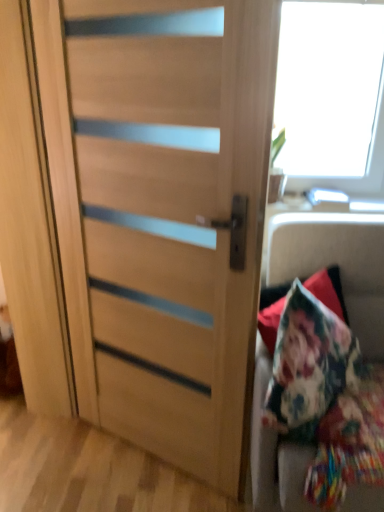
The image size is (384, 512). What do you see at coordinates (161, 213) in the screenshot?
I see `wooden door at center` at bounding box center [161, 213].

Locate an element on the screen. wooden door at center is located at coordinates (161, 213).

Where is `floral fabric cushion at right`? The image size is (384, 512). floral fabric cushion at right is located at coordinates (336, 263).

Describe the element at coordinates (336, 263) in the screenshot. This screenshot has width=384, height=512. I see `floral fabric cushion at right` at that location.

At what (x,y) coordinates should I click in order to perform the action: click on wooden door at center. Please return your answer as a coordinate pair (x, y). Looking at the image, I should click on (161, 213).

Which is more to the left, floral fabric cushion at right or wooden door at center?

From the viewer's perspective, wooden door at center appears more on the left side.

Based on the photo, considering the positions of objects floral fabric cushion at right and wooden door at center in the image provided, who is in front, floral fabric cushion at right or wooden door at center?

wooden door at center is closer to the camera.

Is point (290, 511) positioned behind point (207, 101)?

Yes, it is.

Looking at this image, from the image's perspective, is floral fabric cushion at right located above wooden door at center?

No, from the image's perspective, floral fabric cushion at right is not on top of wooden door at center.

From a real-world perspective, is floral fabric cushion at right physically above wooden door at center?

No, from a real-world perspective, floral fabric cushion at right is not over wooden door at center

Does floral fabric cushion at right have a lesser width compared to wooden door at center?

In fact, floral fabric cushion at right might be wider than wooden door at center.

Based on the photo, in terms of height, does floral fabric cushion at right look taller or shorter compared to wooden door at center?

Clearly, floral fabric cushion at right is shorter compared to wooden door at center.

Is floral fabric cushion at right smaller than wooden door at center?

No, floral fabric cushion at right is not smaller than wooden door at center.

Is floral fabric cushion at right surrounding wooden door at center?

No, wooden door at center is not a part of floral fabric cushion at right.

Is floral fabric cushion at right positioned far away from wooden door at center?

No, floral fabric cushion at right is in close proximity to wooden door at center.

Could you tell me if floral fabric cushion at right is facing wooden door at center?

No, floral fabric cushion at right is not aimed at wooden door at center.

The image size is (384, 512). In order to click on furniture that appears on the right of wooden door at center in this screenshot , I will do `click(336, 263)`.

Does wooden door at center appear on the left side of floral fabric cushion at right?

Yes, wooden door at center is to the left of floral fabric cushion at right.

Is the position of wooden door at center more distant than that of floral fabric cushion at right?

No, it is not.

Which point is more distant from viewer, [82,31] or [299,243]?

The point [299,243] is more distant.

From the image's perspective, between wooden door at center and floral fabric cushion at right, which one is located above?

wooden door at center appears higher in the image.

From a real-world perspective, is wooden door at center under floral fabric cushion at right?

No, from a real-world perspective, wooden door at center is not below floral fabric cushion at right.

Between wooden door at center and floral fabric cushion at right, which one has smaller width?

wooden door at center is thinner.

From their relative heights in the image, would you say wooden door at center is taller or shorter than floral fabric cushion at right?

In the image, wooden door at center appears to be taller than floral fabric cushion at right.

Does wooden door at center have a smaller size compared to floral fabric cushion at right?

Yes, wooden door at center is smaller than floral fabric cushion at right.

Is floral fabric cushion at right completely or partially inside wooden door at center?

No, wooden door at center does not contain floral fabric cushion at right.

Is wooden door at center with floral fabric cushion at right?

No, wooden door at center is not beside floral fabric cushion at right.

Is wooden door at center facing away from floral fabric cushion at right?

wooden door at center does not have its back to floral fabric cushion at right.

How different are the orientations of wooden door at center and floral fabric cushion at right in degrees?

The facing directions of wooden door at center and floral fabric cushion at right are 25.8 degrees apart.

The width and height of the screenshot is (384, 512). In order to click on furniture that appears below the wooden door at center (from a real-world perspective) in this screenshot , I will do `click(336, 263)`.

The width and height of the screenshot is (384, 512). In order to click on door above the floral fabric cushion at right (from the image's perspective) in this screenshot , I will do `click(161, 213)`.

I want to click on furniture behind the wooden door at center, so click(336, 263).